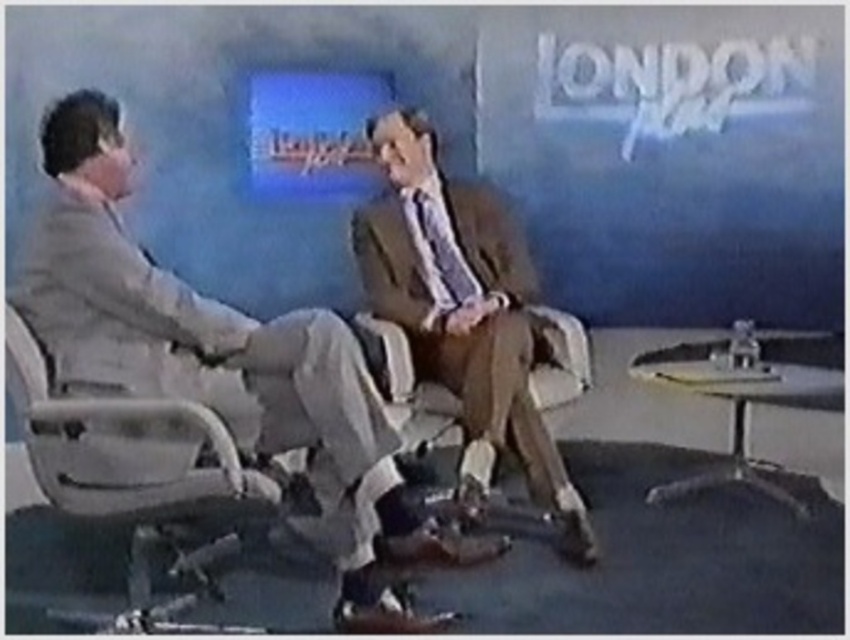
Is point (47, 202) closer to camera compared to point (445, 259)?

Yes, it is in front of point (445, 259).

Is matte gray suit at center taller than brown leather suit at center?

Incorrect, matte gray suit at center's height is not larger of brown leather suit at center's.

This screenshot has height=640, width=850. I want to click on matte gray suit at center, so click(x=201, y=388).

Where is `matte gray suit at center`? This screenshot has width=850, height=640. matte gray suit at center is located at coordinates (201, 388).

Does matte gray suit at center have a lesser width compared to light gray plastic swivel chair at left?

In fact, matte gray suit at center might be wider than light gray plastic swivel chair at left.

At what (x,y) coordinates should I click in order to perform the action: click on matte gray suit at center. Please return your answer as a coordinate pair (x, y). Looking at the image, I should click on (201, 388).

Find the location of a particular element. brown leather suit at center is located at coordinates (463, 310).

Does point (425, 122) come closer to viewer compared to point (9, 390)?

That is False.

Who is more forward, (514, 371) or (207, 468)?

Positioned in front is point (207, 468).

Identify the location of brown leather suit at center. (463, 310).